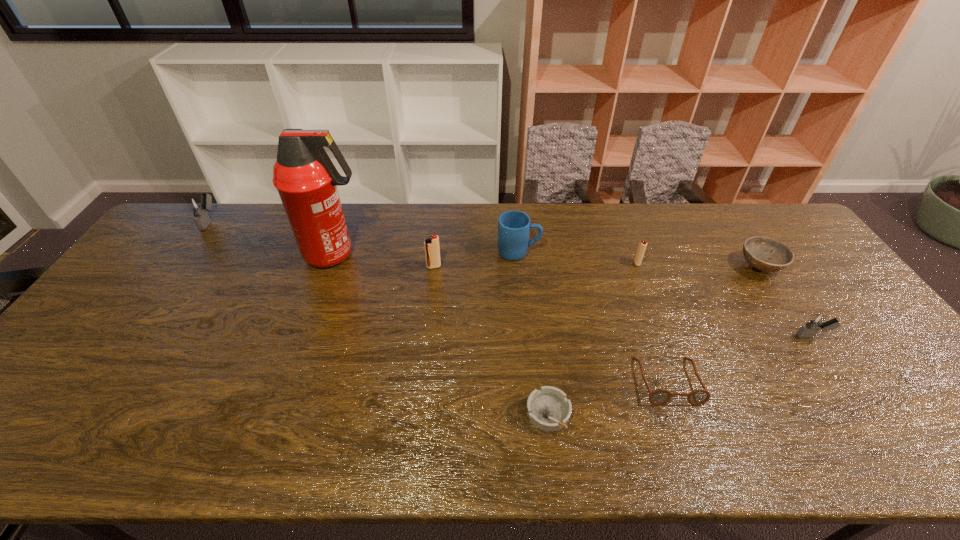
This screenshot has width=960, height=540. In order to click on the closest igniter relative to the mug in this screenshot , I will do `click(432, 250)`.

Find the location of a particular element. The width and height of the screenshot is (960, 540). igniter that is the second nearest to the left red igniter is located at coordinates (199, 206).

At what (x,y) coordinates should I click in order to perform the action: click on vacant space that satisfies the following two spatial constraints: 1. on the front side of the rightmost igniter; 2. on the right side of the brown bowl. Please return your answer as a coordinate pair (x, y). This screenshot has height=540, width=960. Looking at the image, I should click on (806, 336).

The width and height of the screenshot is (960, 540). In order to click on free space that satisfies the following two spatial constraints: 1. on the front side of the third object from left to right; 2. on the left side of the nearest igniter in this screenshot , I will do `click(426, 336)`.

Find the location of a particular element. The image size is (960, 540). vacant area in the image that satisfies the following two spatial constraints: 1. on the back side of the seventh tallest object; 2. on the trigger side of the fire extinguisher is located at coordinates (752, 255).

Image resolution: width=960 pixels, height=540 pixels. What are the coordinates of `free space that satisfies the following two spatial constraints: 1. on the trigger side of the fire extinguisher; 2. on the left side of the bigger red igniter` in the screenshot? It's located at (331, 267).